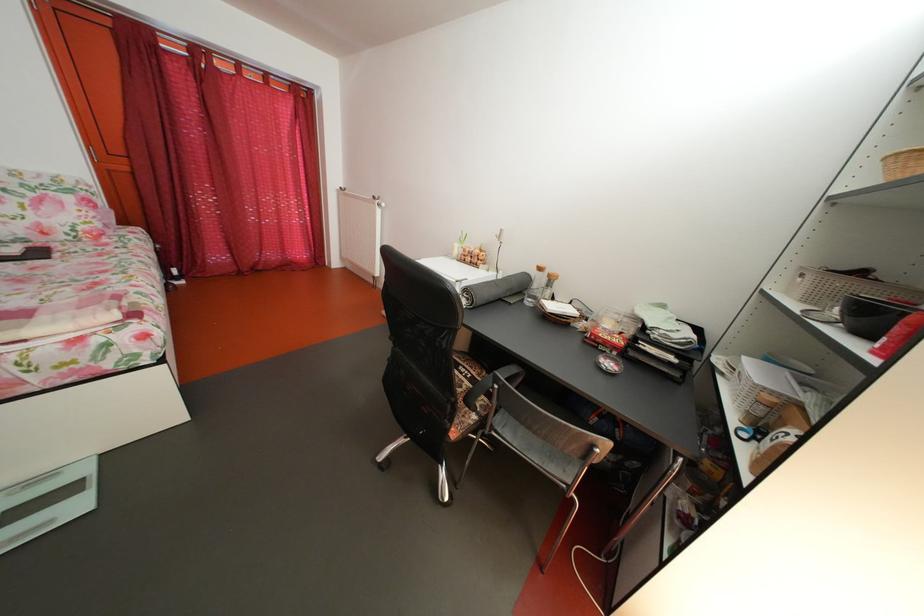
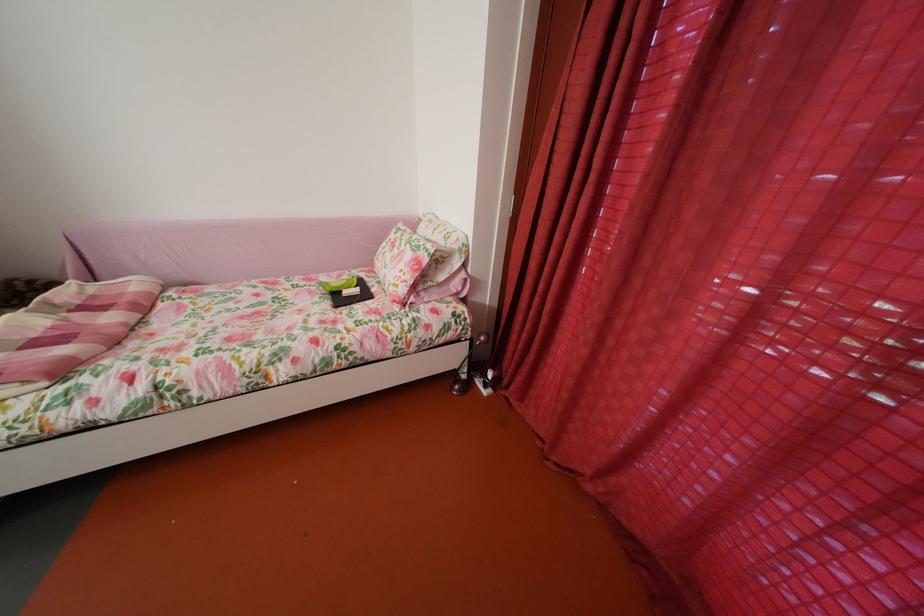
Locate, in the second image, the point that corresponds to [79,205] in the first image.

(419, 262)